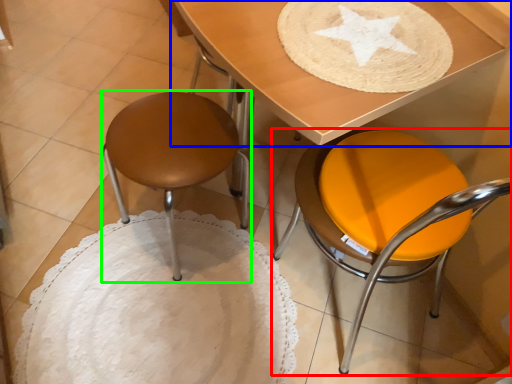
Question: Which is farther away from chair (highlighted by a red box)? table (highlighted by a blue box) or stool (highlighted by a green box)?

Choices:
 (A) table
 (B) stool

Answer: (B)